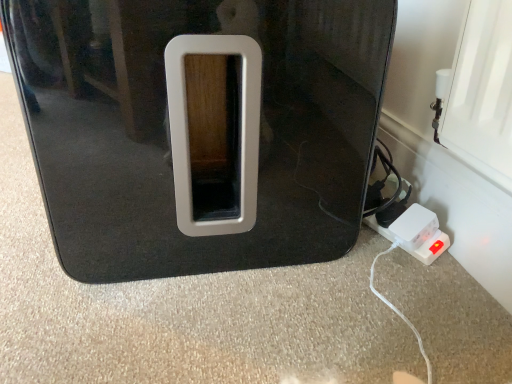
Describe the element at coordinates (199, 128) in the screenshot. The image size is (512, 384). I see `black glossy mini-fridge at center` at that location.

Find the location of `black glossy mini-fridge at center`. black glossy mini-fridge at center is located at coordinates (199, 128).

Locate an element on the screen. black glossy mini-fridge at center is located at coordinates (199, 128).